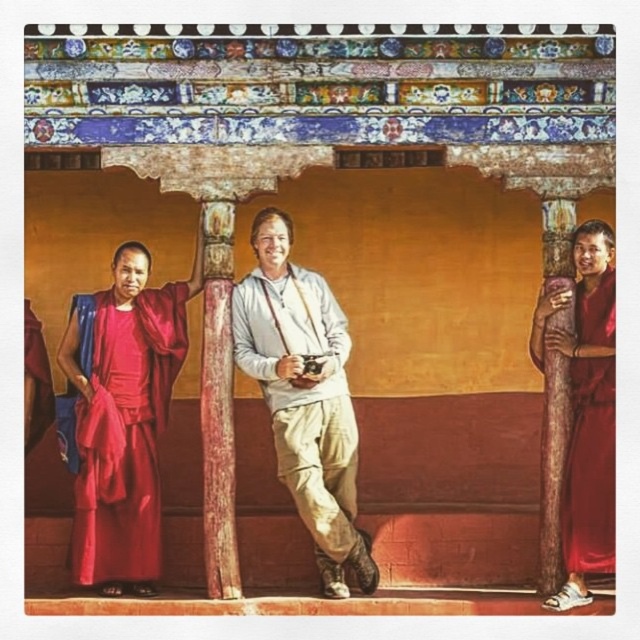
Question: Which object is the closest to the matte gray shirt at center?

Choices:
 (A) light gray cotton shirt at center
 (B) silky red robe at left

Answer: (A)

Question: Estimate the real-world distances between objects in this image. Which object is closer to the matte gray shirt at center?

Choices:
 (A) silky red robe at left
 (B) smooth red cloth at right

Answer: (A)

Question: Which point is closer to the camera?

Choices:
 (A) (330, 566)
 (B) (83, 579)
 (C) (566, 564)

Answer: (C)

Question: Does silky red robe at left lie in front of silky red robe at right?

Choices:
 (A) yes
 (B) no

Answer: (B)

Question: Is matte gray shirt at center thinner than light gray cotton shirt at center?

Choices:
 (A) no
 (B) yes

Answer: (A)

Question: Does silky red robe at left lie behind silky red robe at right?

Choices:
 (A) yes
 (B) no

Answer: (A)